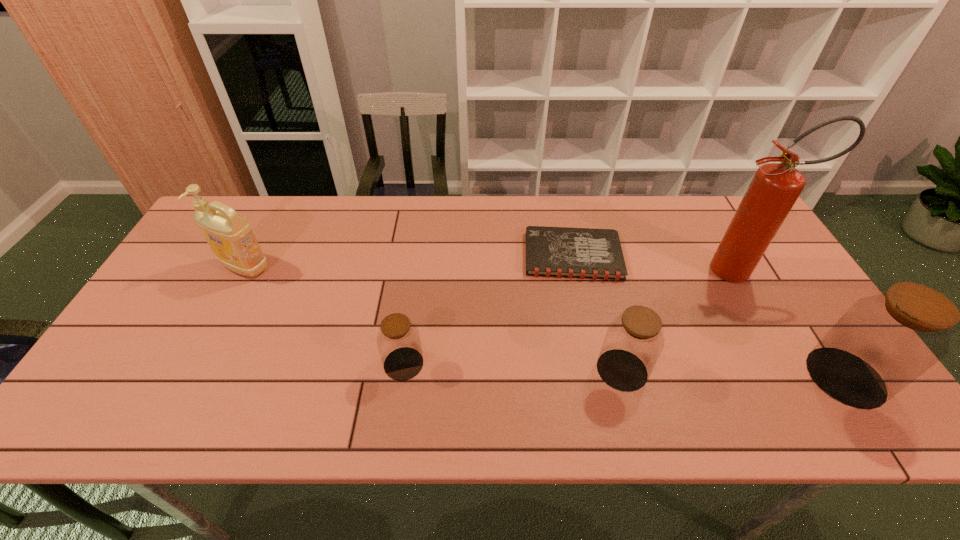
Identify the location of vacant space located on the left of the rightmost jar. (737, 377).

Find the location of a particular element. This screenshot has width=960, height=540. vacant space located 0.090m on the front of the notebook is located at coordinates (584, 306).

In order to click on free location located on the right of the leftmost object in this screenshot , I will do `click(409, 267)`.

Locate an element on the screen. free space located from the nozzle of the fire extinguisher is located at coordinates (637, 271).

The image size is (960, 540). What are the coordinates of `vacant space located 0.380m from the nozzle of the fire extinguisher` in the screenshot? It's located at (571, 271).

Locate an element on the screen. The height and width of the screenshot is (540, 960). free location located from the nozzle of the fire extinguisher is located at coordinates (627, 271).

Identify the location of object at the far edge. This screenshot has height=540, width=960. (558, 252).

You are a GUI agent. You are given a task and a screenshot of the screen. Output one action in this format:
    pyautogui.click(x=<x>, y=<y>)
    Task: Click on the object that is at the left edge
    Image resolution: width=960 pixels, height=540 pixels.
    Given the screenshot: What is the action you would take?
    pyautogui.click(x=229, y=235)

The image size is (960, 540). Identify the location of jar positioned at the right edge. (882, 343).

I want to click on fire extinguisher at the right edge, so click(775, 187).